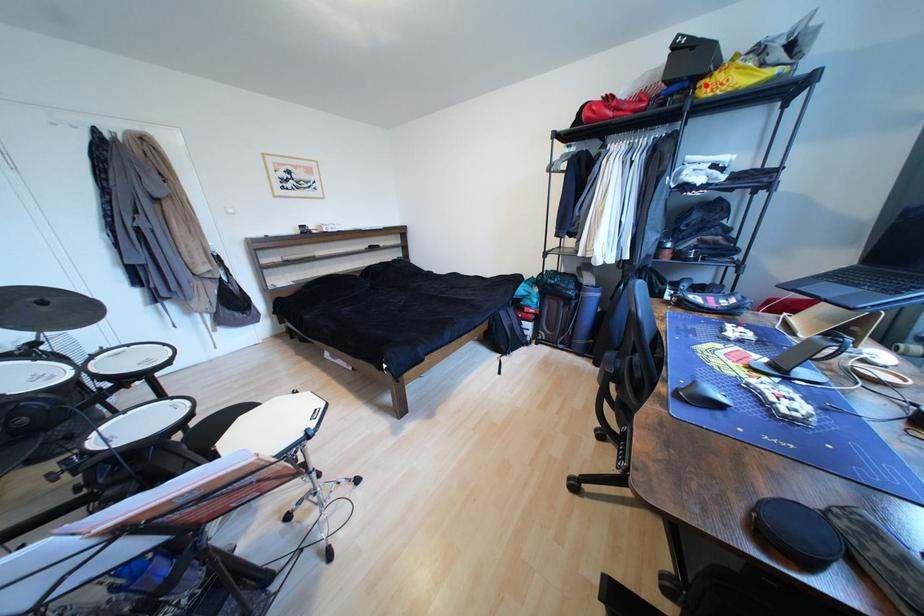
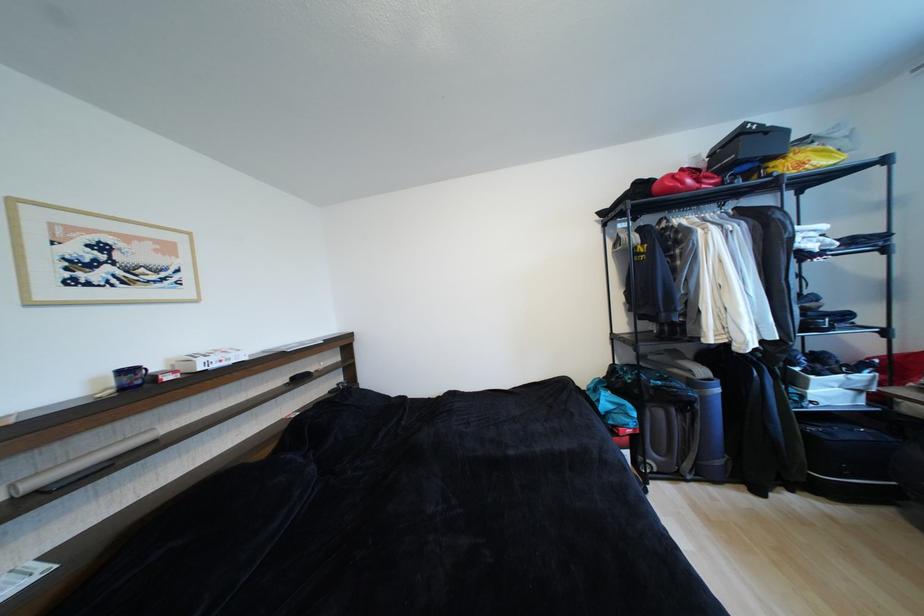
Find the pixel in the second image that matches the highlighted location in the first image.

(780, 166)